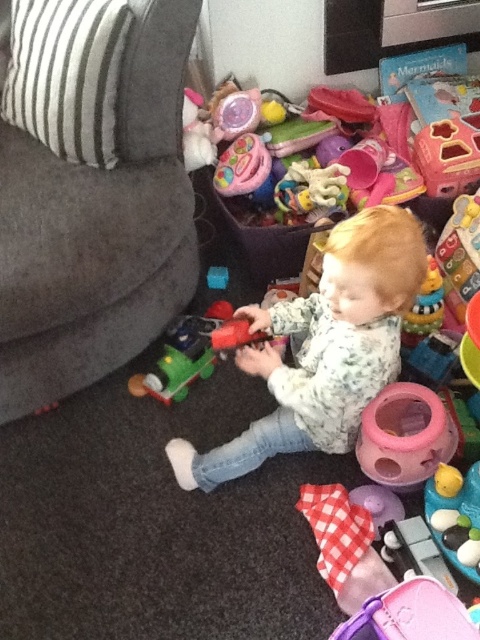
From the picture: You are taking a photo of the scene and want to focus on both the point at point (180, 157) and the point at point (396, 460). Which point is closer to the camera?

Point (180, 157) is closer to the camera than point (396, 460) because it is further to the camera than the other point.

You are a parent trying to organize the play area. You want to place the pink plastic ball at lower right and the matte plastic train at lower left into a toy box. Which object should you pick up first to ensure the other can be easily accessed afterward?

You should pick up the matte plastic train at lower left first because the pink plastic ball at lower right is located below it. By moving the train first, you can then easily access the ball underneath.